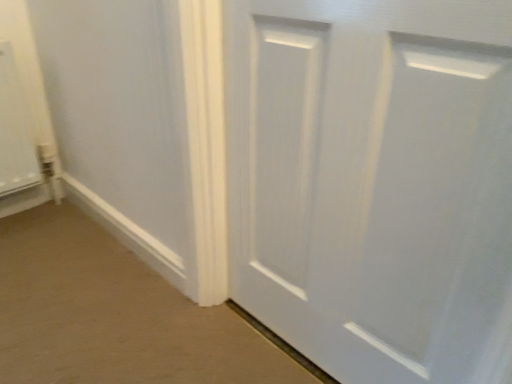
What are the coordinates of `white matte door at center` in the screenshot? It's located at (374, 182).

The image size is (512, 384). What do you see at coordinates (374, 182) in the screenshot?
I see `white matte door at center` at bounding box center [374, 182].

Where is `white matte door at center`? This screenshot has width=512, height=384. white matte door at center is located at coordinates (374, 182).